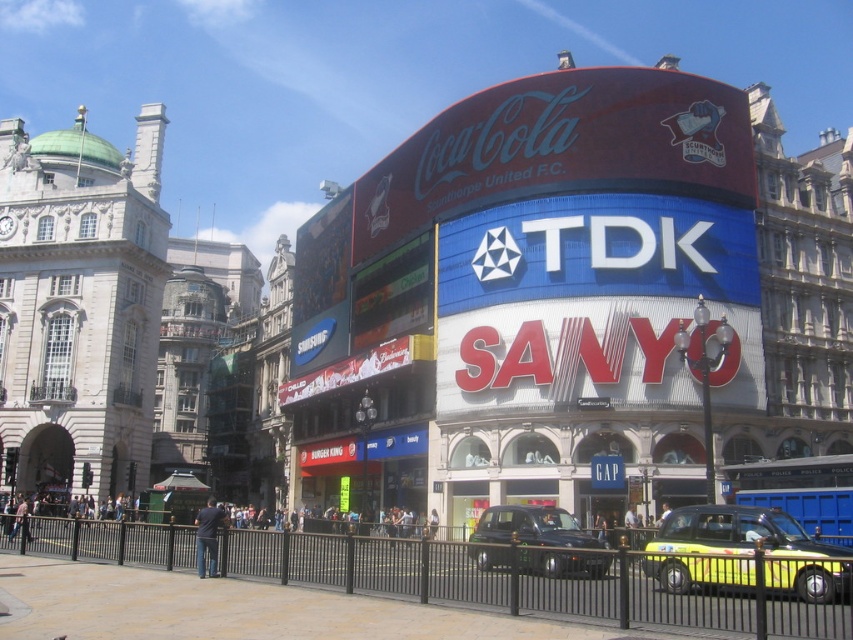
You are standing in the city center and see two points marked in the image. Which point is closer to you, point [738,172] or point [802,476]?

Point [738,172] is closer to you because it is further to the camera than point [802,476].

In the scene shown: You are a photographer trying to capture the matte red signboard at upper center and the blue metallic bus at center in the same frame. Based on their positions, which object would you need to focus on first to ensure both are in the shot?

The matte red signboard at upper center is wider than the blue metallic bus at center, so you should focus on the wider matte red signboard at upper center first to ensure both fit in the frame.

You are standing at the center of the city scene and want to hail a taxi. Which direction should you look to find the yellow metallic taxi at lower right?

The yellow metallic taxi at lower right is located at point (735, 531), which is in the lower right direction from your position at the center of the scene.